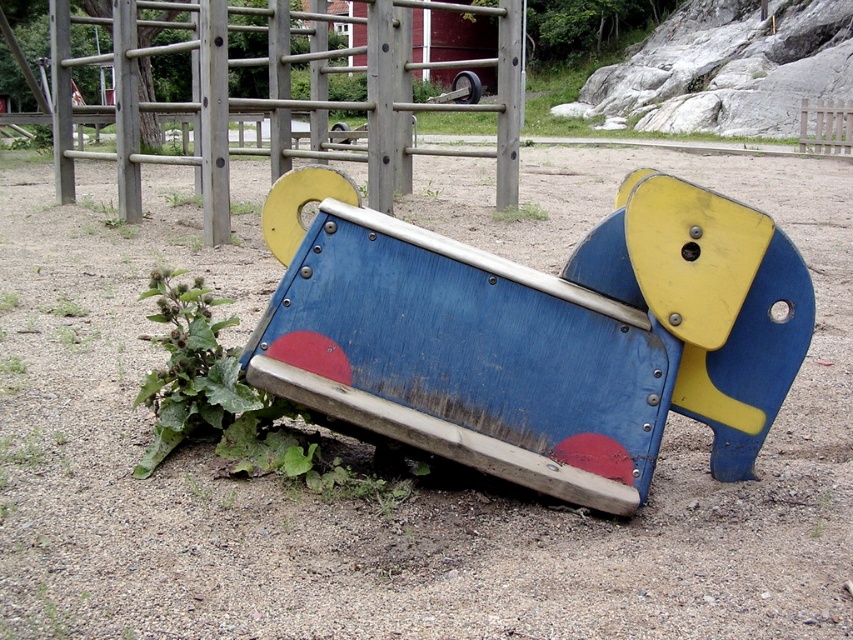
Please provide the exact 2D coordinates of the matte blue wood slide at center in the image. The coordinates should be in the format of a point with two decimal places, such as point X.XX, Y.YY.

The exact 2D coordinates of the matte blue wood slide at center are point (537, 333).

Consider the image. You are a maintenance worker inspecting the playground. You see the matte blue wood slide at center and the green leafy plant at lower left. Which object is positioned to the right side from your viewpoint?

The matte blue wood slide at center is positioned to the right of the green leafy plant at lower left.

You are a child trying to reach the green leafy plant at lower left from the matte blue wood slide at center. Which direction should you walk to get closer to the plant?

Since the matte blue wood slide at center is closer to the viewer than the green leafy plant at lower left, you should walk away from the slide towards the plant to get closer to the green leafy plant at lower left.